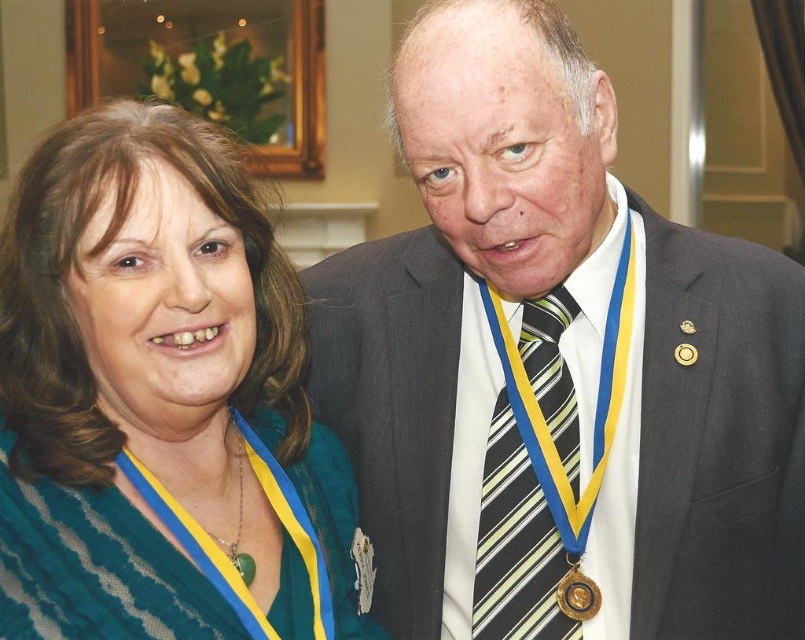
Question: Can you confirm if striped fabric tie at right is thinner than gold metallic medal at lower right?

Choices:
 (A) no
 (B) yes

Answer: (A)

Question: Which of these objects is positioned farthest from the striped fabric tie at right?

Choices:
 (A) matte gray suit at center
 (B) green fabric scarf at left

Answer: (B)

Question: Does matte gray suit at center appear over gold metallic medal at lower right?

Choices:
 (A) yes
 (B) no

Answer: (A)

Question: Which of these objects is positioned closest to the gold metallic medal at lower right?

Choices:
 (A) matte gray suit at center
 (B) green fabric scarf at left

Answer: (A)

Question: Estimate the real-world distances between objects in this image. Which object is closer to the striped fabric tie at right?

Choices:
 (A) green fabric scarf at left
 (B) gold metallic medal at lower right

Answer: (B)

Question: Can you confirm if matte gray suit at center is positioned above gold metallic medal at lower right?

Choices:
 (A) yes
 (B) no

Answer: (A)